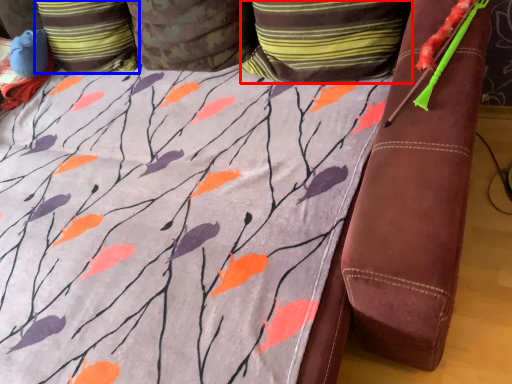
Question: Which point is closer to the camera, pillow (highlighted by a red box) or pillow (highlighted by a blue box)?

Choices:
 (A) pillow
 (B) pillow

Answer: (A)